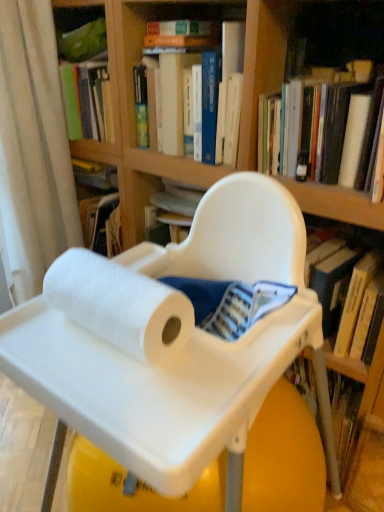
Question: Would you say white plastic tray at center contains white fabric curtain at left?

Choices:
 (A) no
 (B) yes

Answer: (A)

Question: Is white plastic tray at center with white fabric curtain at left?

Choices:
 (A) no
 (B) yes

Answer: (A)

Question: Is white plastic tray at center thinner than white fabric curtain at left?

Choices:
 (A) yes
 (B) no

Answer: (B)

Question: Is white plastic tray at center at the right side of white fabric curtain at left?

Choices:
 (A) no
 (B) yes

Answer: (B)

Question: Considering the relative sizes of white plastic tray at center and white fabric curtain at left in the image provided, is white plastic tray at center bigger than white fabric curtain at left?

Choices:
 (A) yes
 (B) no

Answer: (A)

Question: Is white fabric curtain at left in front of or behind white paper towel at center in the image?

Choices:
 (A) behind
 (B) front

Answer: (A)

Question: Is white fabric curtain at left taller or shorter than white paper towel at center?

Choices:
 (A) tall
 (B) short

Answer: (A)

Question: From the image's perspective, relative to white paper towel at center, is white fabric curtain at left above or below?

Choices:
 (A) above
 (B) below

Answer: (A)

Question: Based on their positions, is white fabric curtain at left located to the left or right of white paper towel at center?

Choices:
 (A) right
 (B) left

Answer: (B)

Question: From the image's perspective, is white matte book at upper right, which is counted as the 1th book, starting from the right, above or below white plastic tray at center?

Choices:
 (A) above
 (B) below

Answer: (A)

Question: Which is correct: white matte book at upper right, which is counted as the 1th book, starting from the right, is inside white plastic tray at center, or outside of it?

Choices:
 (A) outside
 (B) inside

Answer: (A)

Question: Considering the positions of white matte book at upper right, acting as the 2th book starting from the left, and white plastic tray at center in the image, is white matte book at upper right, acting as the 2th book starting from the left, wider or thinner than white plastic tray at center?

Choices:
 (A) wide
 (B) thin

Answer: (B)

Question: Is white matte book at upper right, which is counted as the 1th book, starting from the right, in front of or behind white plastic tray at center in the image?

Choices:
 (A) behind
 (B) front

Answer: (A)

Question: Is white matte book at upper right, acting as the 2th book starting from the left, to the left or to the right of white fabric curtain at left in the image?

Choices:
 (A) right
 (B) left

Answer: (A)

Question: Considering the positions of white matte book at upper right, acting as the 2th book starting from the left, and white fabric curtain at left in the image, is white matte book at upper right, acting as the 2th book starting from the left, bigger or smaller than white fabric curtain at left?

Choices:
 (A) small
 (B) big

Answer: (A)